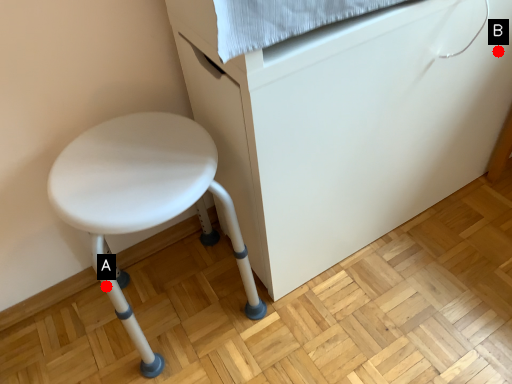
Question: Two points are circled on the image, labeled by A and B beside each circle. Which point is closer to the camera?

Choices:
 (A) A is closer
 (B) B is closer

Answer: (A)